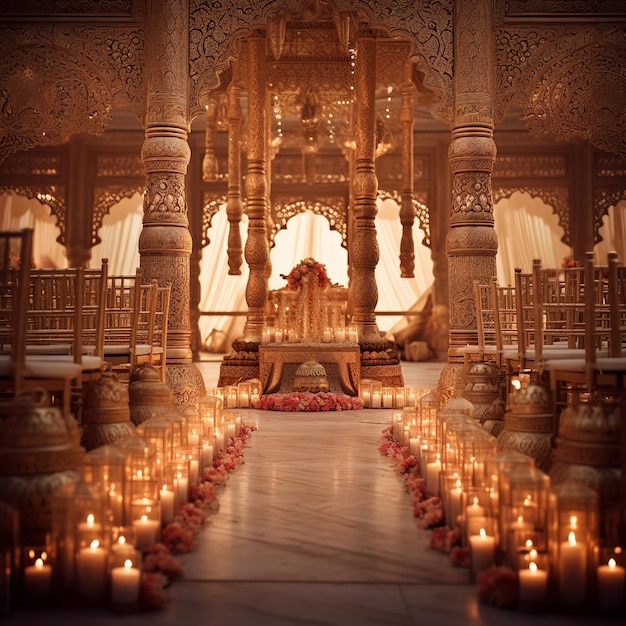
Identify the location of candles. This screenshot has width=626, height=626. (139, 501).